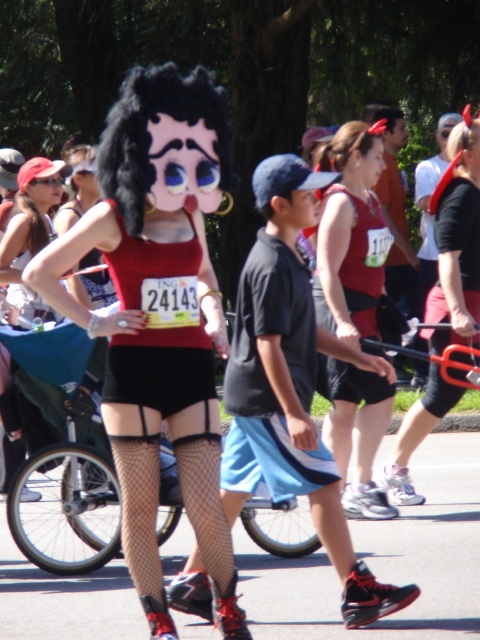
Who is shorter, matte black wig at center or black mesh shorts at center?

With less height is matte black wig at center.

Is point (172, 342) behind point (397, 449)?

No, it is not.

Find the location of `matte black wig at center`. matte black wig at center is located at coordinates (158, 316).

Does matte black wig at center have a smaller size compared to matte black tank top at upper left?

Incorrect, matte black wig at center is not smaller in size than matte black tank top at upper left.

Is matte black wig at center taller than matte black tank top at upper left?

Indeed, matte black wig at center has a greater height compared to matte black tank top at upper left.

The height and width of the screenshot is (640, 480). What do you see at coordinates (158, 316) in the screenshot?
I see `matte black wig at center` at bounding box center [158, 316].

This screenshot has width=480, height=640. Identify the location of matte black wig at center. (158, 316).

What do you see at coordinates (350, 234) in the screenshot? I see `matte red tank top at center` at bounding box center [350, 234].

Looking at this image, is matte red tank top at center closer to camera compared to black mesh shorts at center?

Yes, matte red tank top at center is closer to the viewer.

The height and width of the screenshot is (640, 480). What do you see at coordinates (350, 234) in the screenshot?
I see `matte red tank top at center` at bounding box center [350, 234].

The height and width of the screenshot is (640, 480). What are the coordinates of `matte red tank top at center` in the screenshot? It's located at (350, 234).